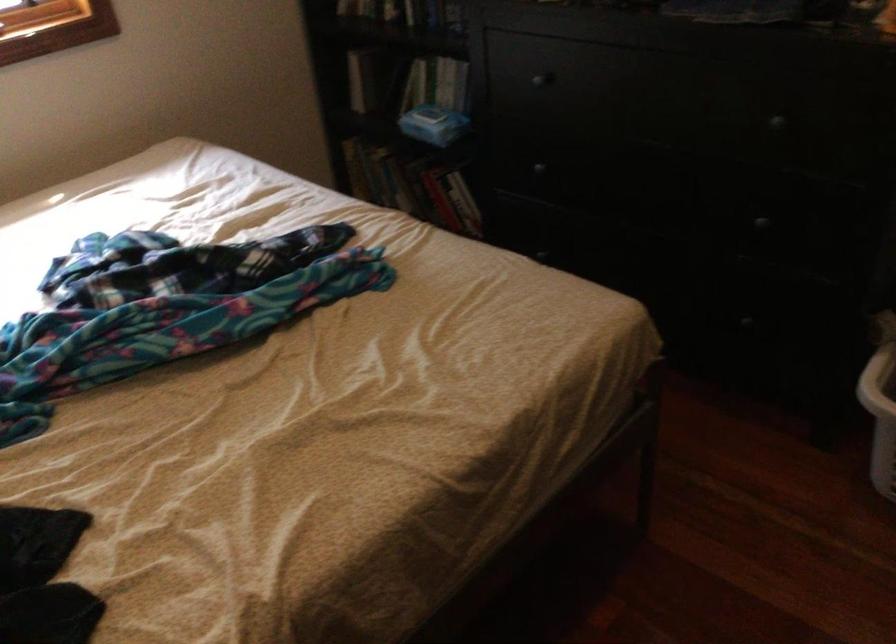
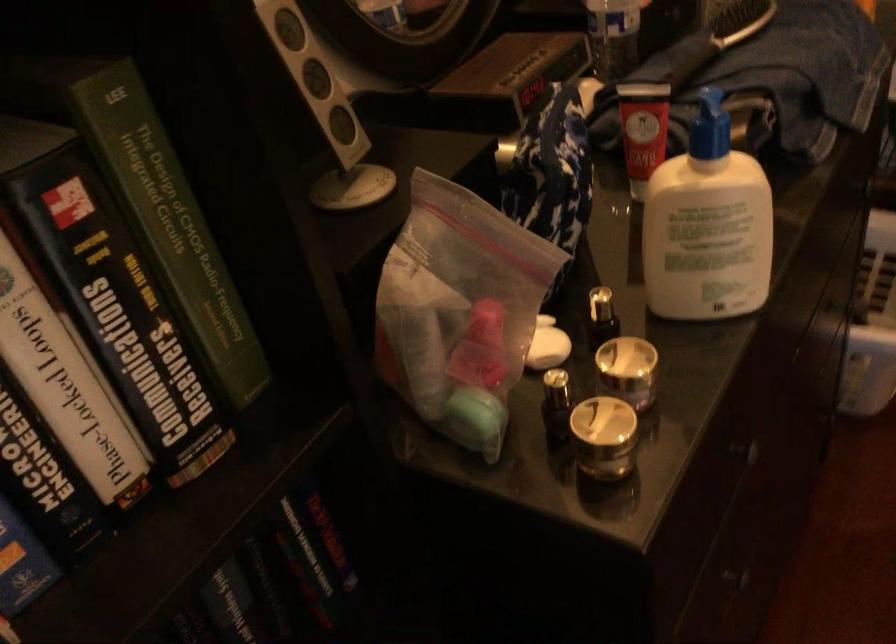
Where in the second image is the point corresponding to (x=548, y=169) from the first image?

(738, 581)